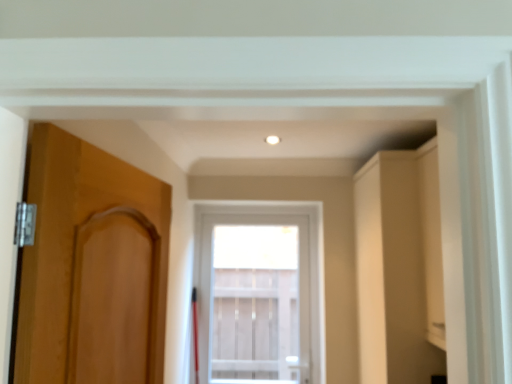
At what (x,y) coordinates should I click in order to perform the action: click on clear glass window at center. Please return your answer as a coordinate pair (x, y). Image resolution: width=512 pixels, height=384 pixels. Looking at the image, I should click on (258, 293).

The image size is (512, 384). What are the coordinates of `matte beige cabinet at right` in the screenshot? It's located at (399, 267).

From the image's perspective, who appears lower, matte wood door at left or matte beige cabinet at right?

matte beige cabinet at right.

From a real-world perspective, which object rests below the other?

matte beige cabinet at right.

Is the surface of matte wood door at left in direct contact with matte beige cabinet at right?

No, matte wood door at left is not touching matte beige cabinet at right.

Can you tell me how much matte wood door at left and matte beige cabinet at right differ in facing direction?

They differ by 179 degrees in their facing directions.

The height and width of the screenshot is (384, 512). I want to click on door in front of the matte beige cabinet at right, so click(92, 267).

Do you think matte beige cabinet at right is within matte wood door at left, or outside of it?

matte beige cabinet at right lies outside matte wood door at left.

Considering the sizes of objects matte beige cabinet at right and matte wood door at left in the image provided, who is wider, matte beige cabinet at right or matte wood door at left?

matte beige cabinet at right.

Is matte beige cabinet at right smaller than matte wood door at left?

Incorrect, matte beige cabinet at right is not smaller in size than matte wood door at left.

Is clear glass window at center turned away from matte wood door at left?

No.

From a real-world perspective, does clear glass window at center sit lower than matte wood door at left?

Yes, from a real-world perspective, clear glass window at center is below matte wood door at left.

From the image's perspective, which is below, clear glass window at center or matte wood door at left?

clear glass window at center appears lower in the image.

Does clear glass window at center touch matte wood door at left?

No, clear glass window at center is not next to matte wood door at left.

In the scene shown: Is matte beige cabinet at right not close to clear glass window at center?

Yes, matte beige cabinet at right and clear glass window at center are quite far apart.

Is clear glass window at center a part of matte beige cabinet at right?

Actually, clear glass window at center is outside matte beige cabinet at right.

What are the coordinates of `cabinetry above the clear glass window at center (from the image's perspective)` in the screenshot? It's located at (399, 267).

Considering the positions of objects matte wood door at left and clear glass window at center in the image provided, who is more to the right, matte wood door at left or clear glass window at center?

clear glass window at center is more to the right.

How far apart are matte wood door at left and clear glass window at center?

They are 2.69 meters apart.

Between matte wood door at left and clear glass window at center, which one has larger width?

With larger width is clear glass window at center.

From the image's perspective, which one is positioned higher, matte wood door at left or clear glass window at center?

matte wood door at left is shown above in the image.

From the image's perspective, is clear glass window at center on top of matte beige cabinet at right?

No, from the image's perspective, clear glass window at center is not on top of matte beige cabinet at right.

Which of these two, clear glass window at center or matte beige cabinet at right, is bigger?

matte beige cabinet at right is bigger.

At what (x,y) coordinates should I click in order to perform the action: click on window that is under the matte beige cabinet at right (from a real-world perspective). Please return your answer as a coordinate pair (x, y). This screenshot has width=512, height=384. Looking at the image, I should click on (258, 293).

Would you say clear glass window at center contains matte beige cabinet at right?

That's incorrect, matte beige cabinet at right is not inside clear glass window at center.

You are a GUI agent. You are given a task and a screenshot of the screen. Output one action in this format:
    pyautogui.click(x=<x>, y=<y>)
    Task: Click on the cabinetry behind the matte wood door at left
    The image size is (512, 384).
    Given the screenshot: What is the action you would take?
    pyautogui.click(x=399, y=267)

Find the location of a particular element. Image resolution: width=512 pixels, height=384 pixels. cabinetry below the matte wood door at left (from the image's perspective) is located at coordinates (399, 267).

Estimate the real-world distances between objects in this image. Which object is closer to matte beige cabinet at right, clear glass window at center or matte wood door at left?

matte wood door at left is closer to matte beige cabinet at right.

Considering their positions, is matte wood door at left positioned closer to clear glass window at center than matte beige cabinet at right?

The object closer to clear glass window at center is matte beige cabinet at right.

Considering their positions, is matte beige cabinet at right positioned further to clear glass window at center than matte wood door at left?

Among the two, matte wood door at left is located further to clear glass window at center.

Based on their spatial positions, is matte wood door at left or clear glass window at center closer to matte beige cabinet at right?

matte wood door at left lies closer to matte beige cabinet at right than the other object.

Based on their spatial positions, is matte beige cabinet at right or clear glass window at center further from matte wood door at left?

clear glass window at center.

When comparing their distances from matte wood door at left, does clear glass window at center or matte beige cabinet at right seem closer?

Among the two, matte beige cabinet at right is located nearer to matte wood door at left.

Image resolution: width=512 pixels, height=384 pixels. Identify the location of cabinetry located between matte wood door at left and clear glass window at center in the depth direction. (399, 267).